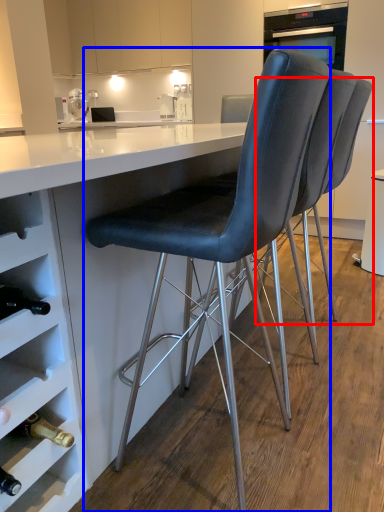
Question: Which object appears farthest to the camera in this image, chair (highlighted by a red box) or chair (highlighted by a blue box)?

Choices:
 (A) chair
 (B) chair

Answer: (A)